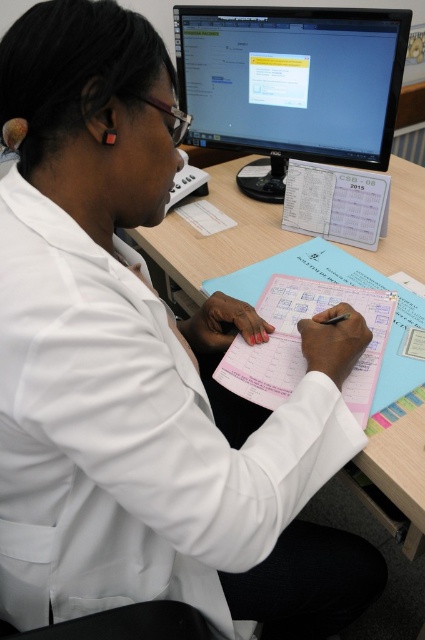
Looking at this image, you are a medical professional who needs to place a new document on the desk. The document is the same size as the pink paper at center. Where should you place it so it doesn not block the matte black monitor at upper center?

Since the matte black monitor at upper center is larger than the pink paper at center, placing the new document to the side or below the monitor would prevent it from blocking the monitor.

From the picture: You are a medical professional who needs to locate the matte black monitor at upper center. Based on the coordinates provided, can you confirm if the point at (x=291, y=84) is the correct location for the matte black monitor at upper center?

Yes, the point at (x=291, y=84) corresponds to the matte black monitor at upper center.